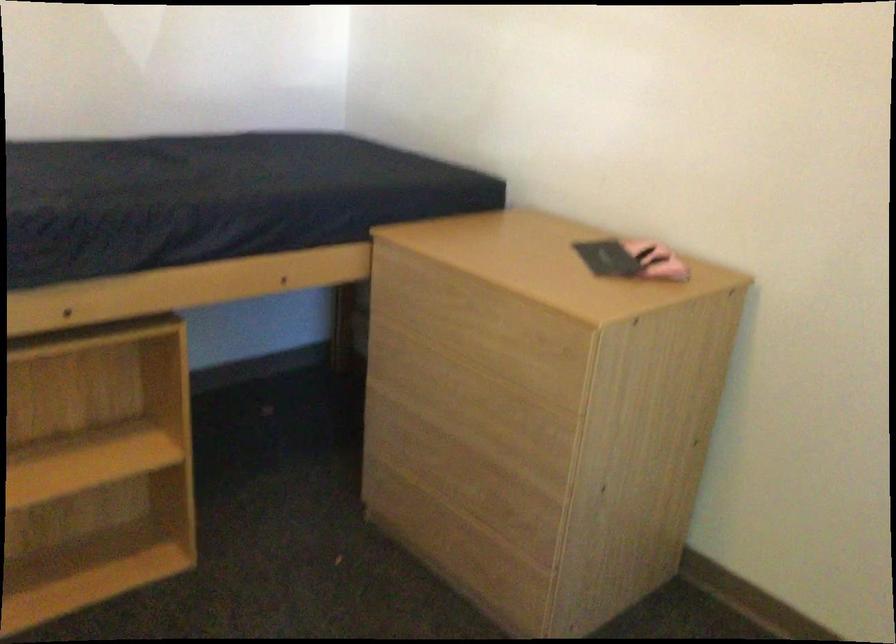
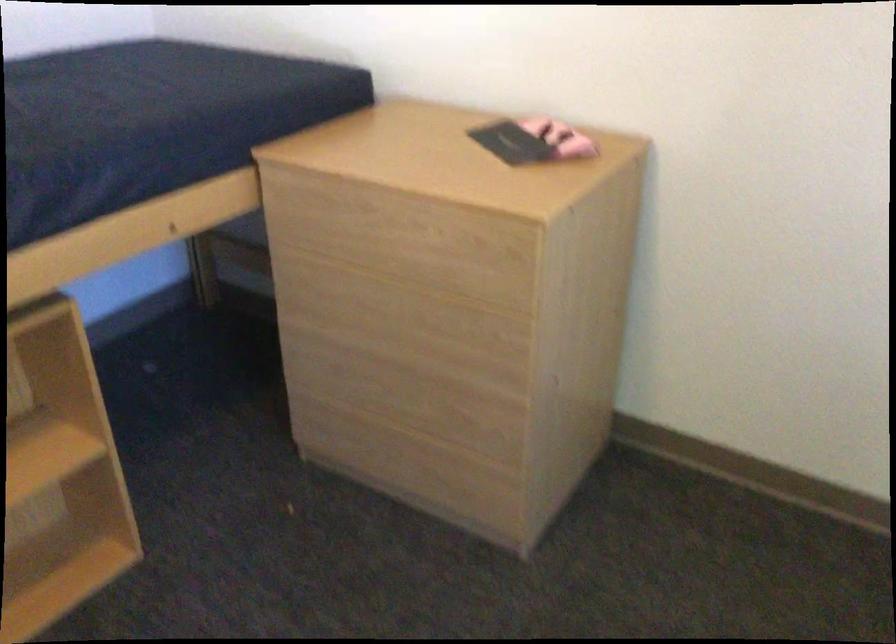
The images are taken continuously from a first-person perspective. In which direction are you moving?

The cameraman moved toward left, forward.